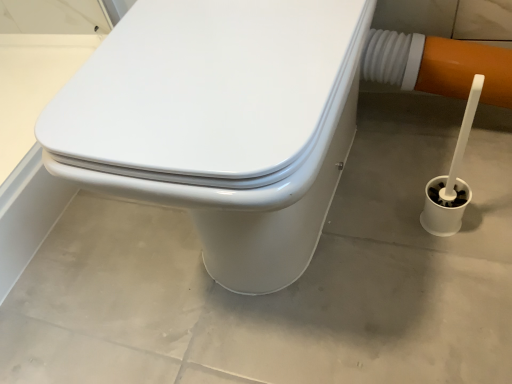
Question: Should I look upward or downward to see white glossy toilet at center?

Choices:
 (A) down
 (B) up

Answer: (B)